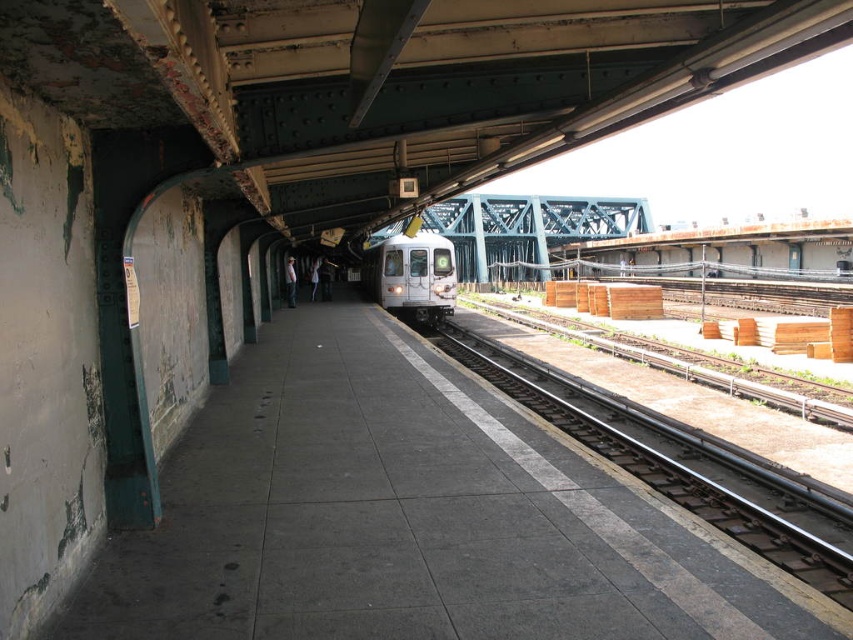
Question: Can you confirm if metal/smooth train track at right is positioned to the right of silver metallic train at center?

Choices:
 (A) no
 (B) yes

Answer: (B)

Question: Which of the following is the closest to the observer?

Choices:
 (A) silver metallic train at center
 (B) metal/smooth train track at right

Answer: (B)

Question: Does metal/smooth train track at right have a greater width compared to silver metallic train at center?

Choices:
 (A) yes
 (B) no

Answer: (B)

Question: Does metal/smooth train track at right come behind silver metallic train at center?

Choices:
 (A) no
 (B) yes

Answer: (A)